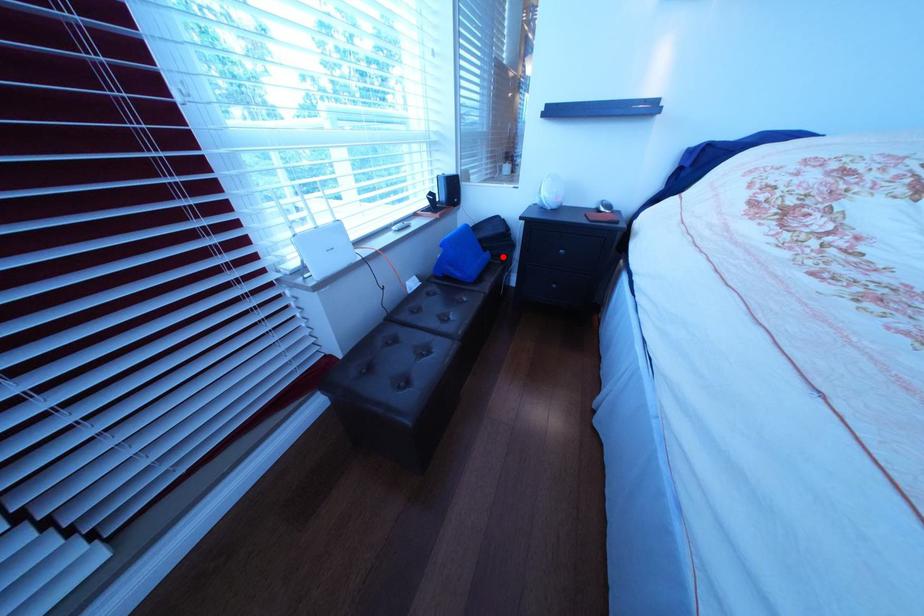
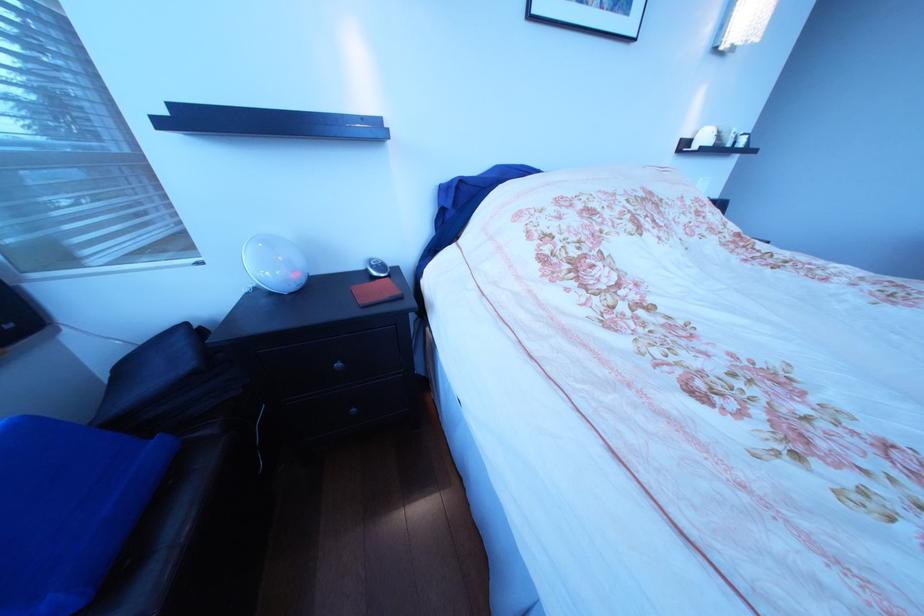
Find the pixel in the second image that matches the highlighted location in the first image.

(172, 450)